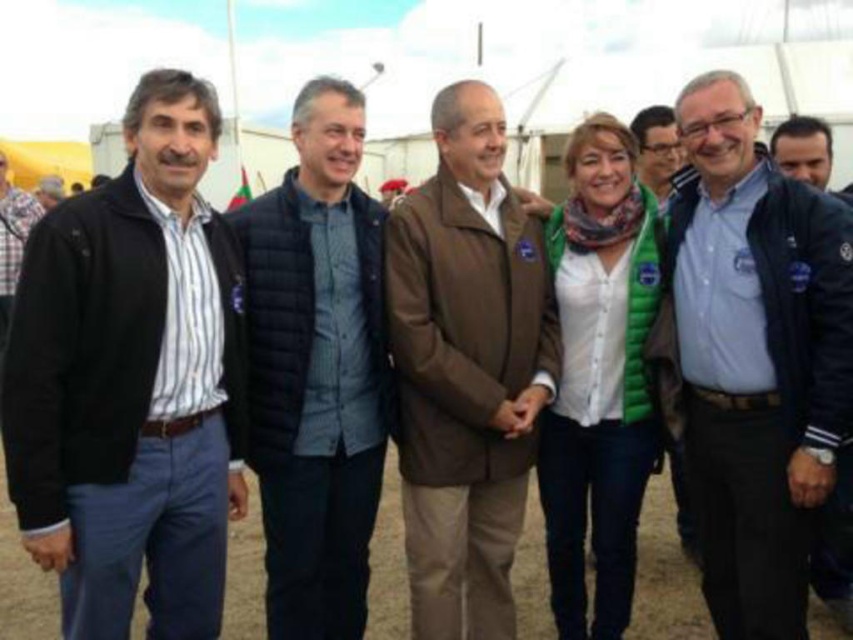
Question: Does matte black jacket at center have a smaller size compared to matte black jacket at upper center?

Choices:
 (A) no
 (B) yes

Answer: (B)

Question: In this image, where is brown leather jacket at center located relative to matte black jacket at center?

Choices:
 (A) left
 (B) right

Answer: (A)

Question: Based on their relative distances, which object is farther from the matte black jacket at left?

Choices:
 (A) matte black jacket at center
 (B) blue fabric shirt at center

Answer: (A)

Question: Estimate the real-world distances between objects in this image. Which object is closer to the blue fabric shirt at center?

Choices:
 (A) matte black jacket at left
 (B) matte black jacket at center
 (C) brown leather jacket at center
 (D) black quilted vest at center

Answer: (C)

Question: Is matte black jacket at left positioned before matte black jacket at center?

Choices:
 (A) no
 (B) yes

Answer: (B)

Question: Estimate the real-world distances between objects in this image. Which object is farther from the matte black jacket at upper center?

Choices:
 (A) brown leather jacket at center
 (B) black quilted vest at center

Answer: (B)